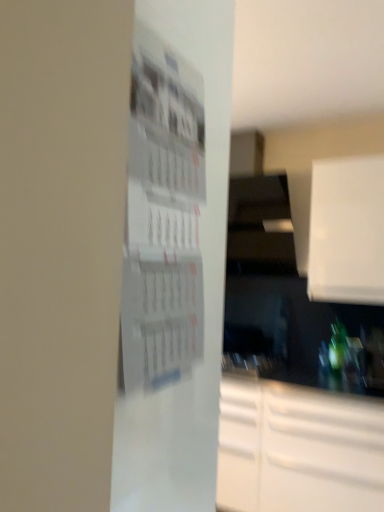
Question: From the image's perspective, does white paper at center appear lower than white matte cabinet at upper right?

Choices:
 (A) no
 (B) yes

Answer: (B)

Question: Would you say white paper at center contains white matte cabinet at upper right?

Choices:
 (A) no
 (B) yes

Answer: (A)

Question: Considering the relative sizes of white paper at center and white matte cabinet at upper right in the image provided, is white paper at center taller than white matte cabinet at upper right?

Choices:
 (A) no
 (B) yes

Answer: (A)

Question: Is white paper at center thinner than white matte cabinet at upper right?

Choices:
 (A) yes
 (B) no

Answer: (A)

Question: Considering the relative sizes of white paper at center and white matte cabinet at upper right in the image provided, is white paper at center wider than white matte cabinet at upper right?

Choices:
 (A) no
 (B) yes

Answer: (A)

Question: From a real-world perspective, is white paper at center positioned above or below green glass bottle at lower right?

Choices:
 (A) below
 (B) above

Answer: (B)

Question: Is point (125, 390) positioned closer to the camera than point (340, 337)?

Choices:
 (A) farther
 (B) closer

Answer: (B)

Question: Considering the relative positions of white paper at center and green glass bottle at lower right in the image provided, is white paper at center to the left or to the right of green glass bottle at lower right?

Choices:
 (A) right
 (B) left

Answer: (B)

Question: Relative to green glass bottle at lower right, is white paper at center in front or behind?

Choices:
 (A) behind
 (B) front

Answer: (B)

Question: Based on their sizes in the image, would you say green glass bottle at lower right is bigger or smaller than white paper at center?

Choices:
 (A) small
 (B) big

Answer: (A)

Question: In terms of width, does green glass bottle at lower right look wider or thinner when compared to white paper at center?

Choices:
 (A) thin
 (B) wide

Answer: (B)

Question: Considering the positions of green glass bottle at lower right and white paper at center in the image, is green glass bottle at lower right taller or shorter than white paper at center?

Choices:
 (A) short
 (B) tall

Answer: (A)

Question: From a real-world perspective, is green glass bottle at lower right positioned above or below white paper at center?

Choices:
 (A) below
 (B) above

Answer: (A)

Question: From a real-world perspective, is green glass bottle at lower right above or below white matte cabinet at upper right?

Choices:
 (A) below
 (B) above

Answer: (A)

Question: Is green glass bottle at lower right spatially inside white matte cabinet at upper right, or outside of it?

Choices:
 (A) outside
 (B) inside

Answer: (A)